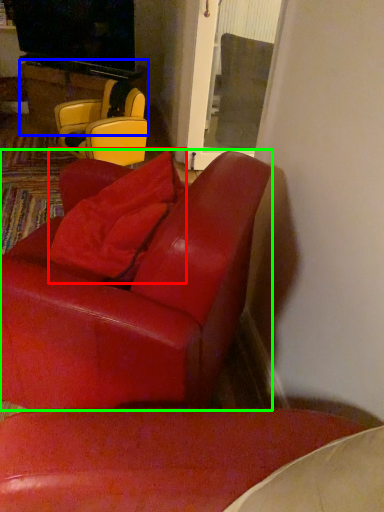
Question: Which object is the closest to the pillow (highlighted by a red box)? Choose among these: table (highlighted by a blue box) or chair (highlighted by a green box).

Choices:
 (A) table
 (B) chair

Answer: (B)